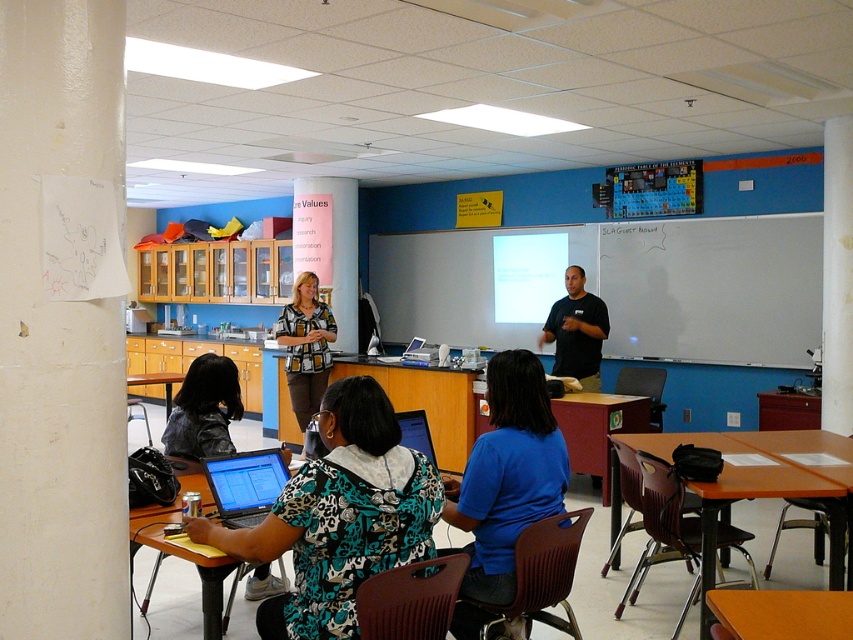
Question: Which of the following is the farthest from the observer?

Choices:
 (A) (654, 330)
 (B) (190, 390)
 (C) (252, 500)
 (D) (321, 392)

Answer: (A)

Question: Which of these objects is positioned closest to the white paper at left?

Choices:
 (A) printed fabric blouse at center
 (B) brown wooden table at lower right
 (C) whiteboard at upper center
 (D) matte plastic table at lower center

Answer: (D)

Question: Considering the relative positions of matte plastic table at lower center and orange matte table at lower right in the image provided, where is matte plastic table at lower center located with respect to orange matte table at lower right?

Choices:
 (A) right
 (B) left

Answer: (B)

Question: Which point is farther to the camera?

Choices:
 (A) white matte/scratch-free whiteboard at upper right
 (B) matte plastic table at lower center

Answer: (A)

Question: In this image, where is whiteboard at upper center located relative to printed fabric shirt at center?

Choices:
 (A) left
 (B) right

Answer: (B)

Question: Can you confirm if white paper at left is wider than printed fabric blouse at center?

Choices:
 (A) yes
 (B) no

Answer: (B)